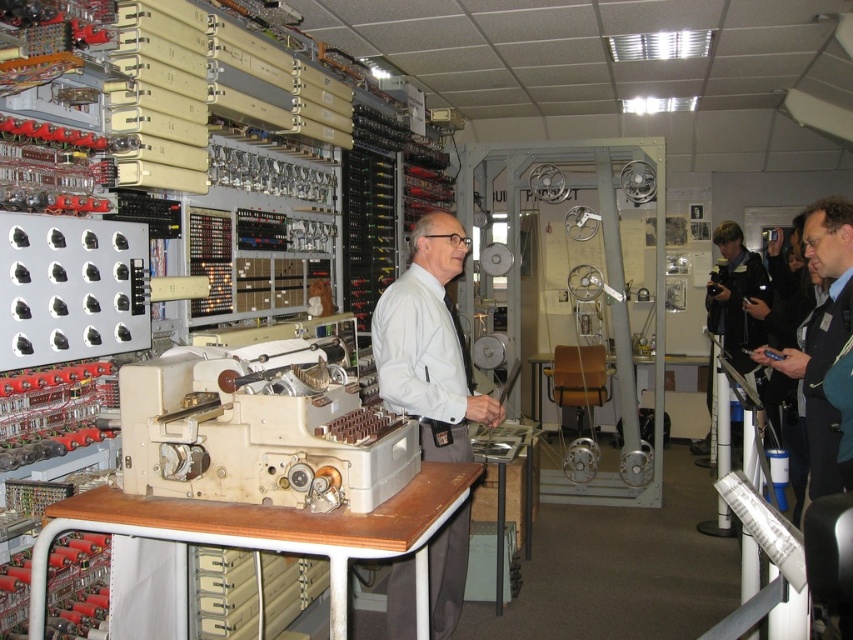
From the picture: Who is shorter, beige plastic typewriter at center or black leather jacket at right?

Standing shorter between the two is beige plastic typewriter at center.

Can you confirm if beige plastic typewriter at center is positioned to the left of black leather jacket at right?

Correct, you'll find beige plastic typewriter at center to the left of black leather jacket at right.

Between point (358, 400) and point (756, 275), which one is positioned in front?

Point (358, 400) is in front.

Find the location of `beige plastic typewriter at center`. beige plastic typewriter at center is located at coordinates pyautogui.click(x=260, y=428).

Can you confirm if dark blue jacket at right is shorter than black leather jacket at right?

Yes.

Is dark blue jacket at right below black leather jacket at right?

Yes.

Between point (828, 252) and point (738, 294), which one is positioned in front?

Positioned in front is point (828, 252).

This screenshot has height=640, width=853. I want to click on dark blue jacket at right, so click(821, 337).

Does beige plastic typewriter at center have a lesser width compared to white matte shirt at center?

In fact, beige plastic typewriter at center might be wider than white matte shirt at center.

Does point (224, 419) come closer to viewer compared to point (370, 326)?

Yes, point (224, 419) is closer to viewer.

Which is in front, point (157, 472) or point (445, 376)?

Point (157, 472)

At what (x,y) coordinates should I click in order to perform the action: click on beige plastic typewriter at center. Please return your answer as a coordinate pair (x, y). Looking at the image, I should click on (260, 428).